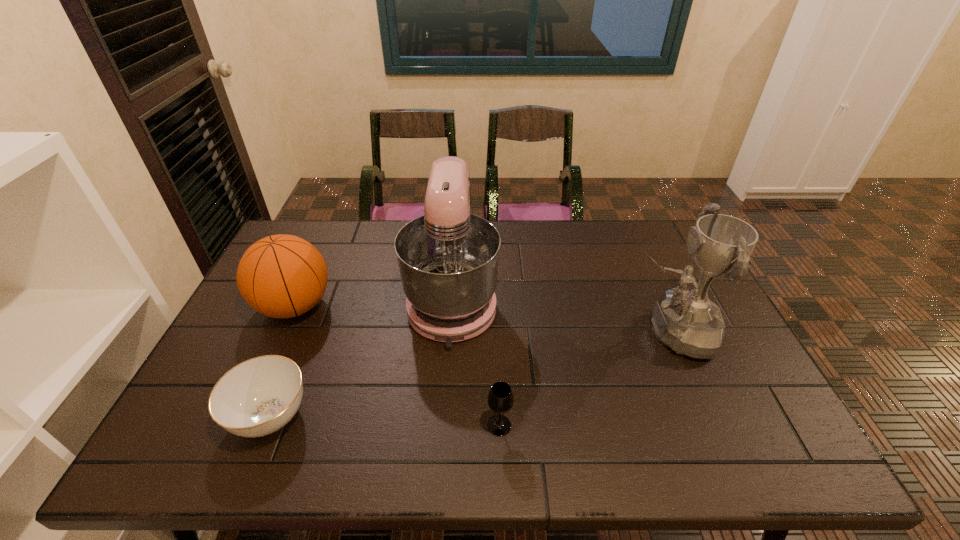
Where is `vacant space that's between the award and the chinaware`? vacant space that's between the award and the chinaware is located at coordinates (470, 374).

Locate an element on the screen. The height and width of the screenshot is (540, 960). free spot between the basketball and the mixer is located at coordinates (373, 303).

This screenshot has width=960, height=540. Find the location of `free area in between the rightmost object and the mixer`. free area in between the rightmost object and the mixer is located at coordinates (562, 316).

At what (x,y) coordinates should I click in order to perform the action: click on empty location between the shortest object and the wineglass. Please return your answer as a coordinate pair (x, y). Looking at the image, I should click on (385, 421).

Identify which object is the closest to the wineglass. Please provide its 2D coordinates. Your answer should be formatted as a tuple, i.e. [(x, y)], where the tuple contains the x and y coordinates of a point satisfying the conditions above.

[(448, 258)]

The height and width of the screenshot is (540, 960). In order to click on object that is the fourth closest to the third tallest object in this screenshot , I will do `click(687, 321)`.

Locate an element on the screen. vacant space that satisfies the following two spatial constraints: 1. on the front-facing side of the mixer; 2. on the left side of the wineglass is located at coordinates (444, 426).